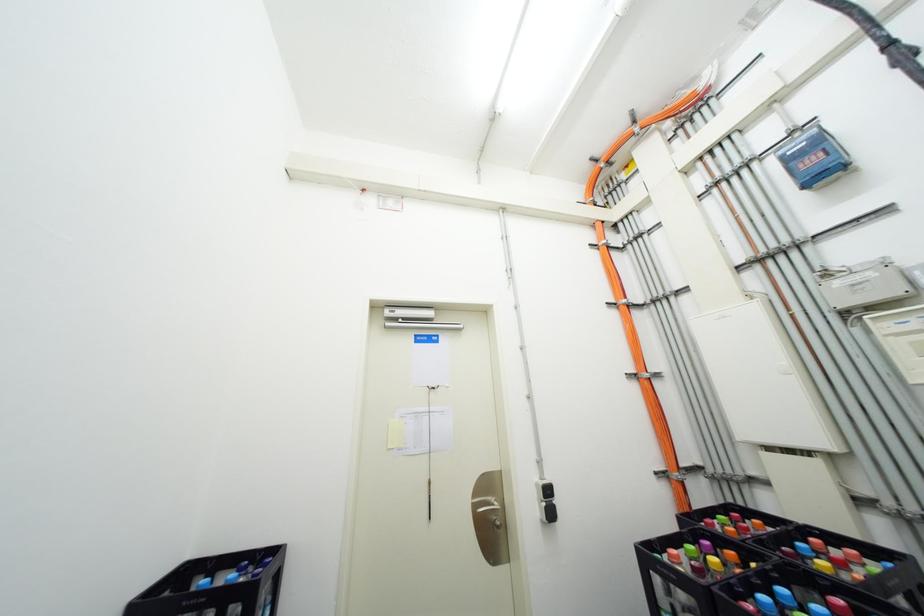
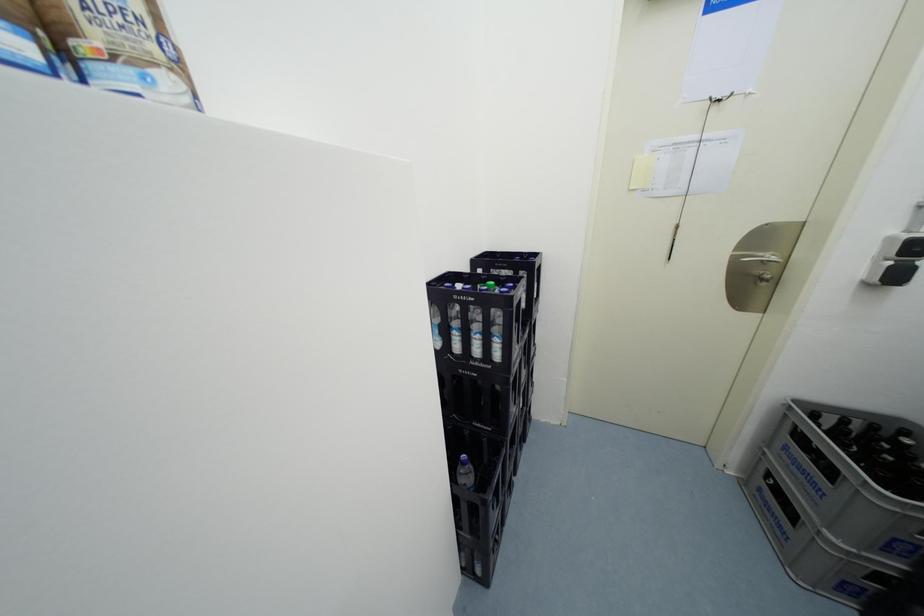
The first image is from the beginning of the video and the second image is from the end. How did the camera likely rotate when shooting the video?

The camera rotated toward left-down.